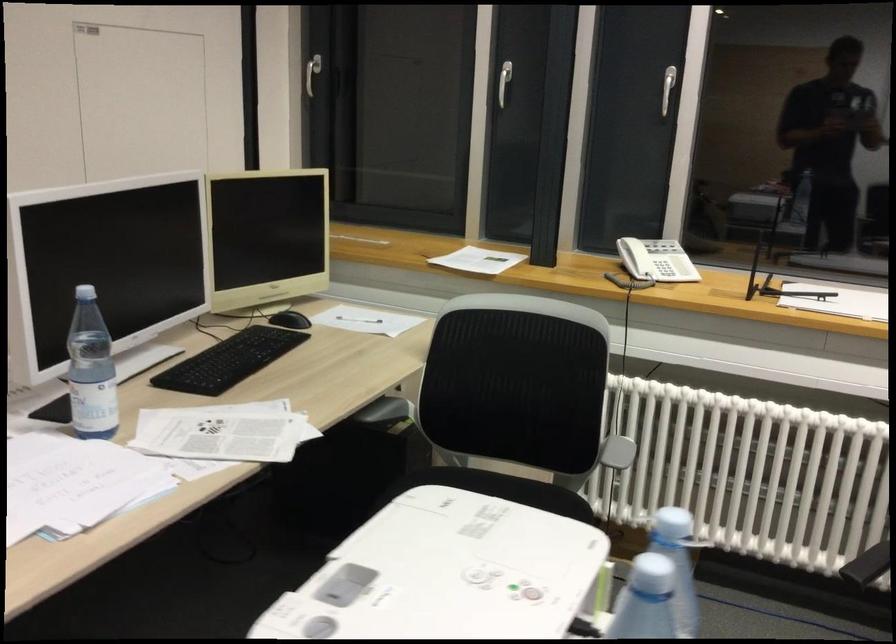
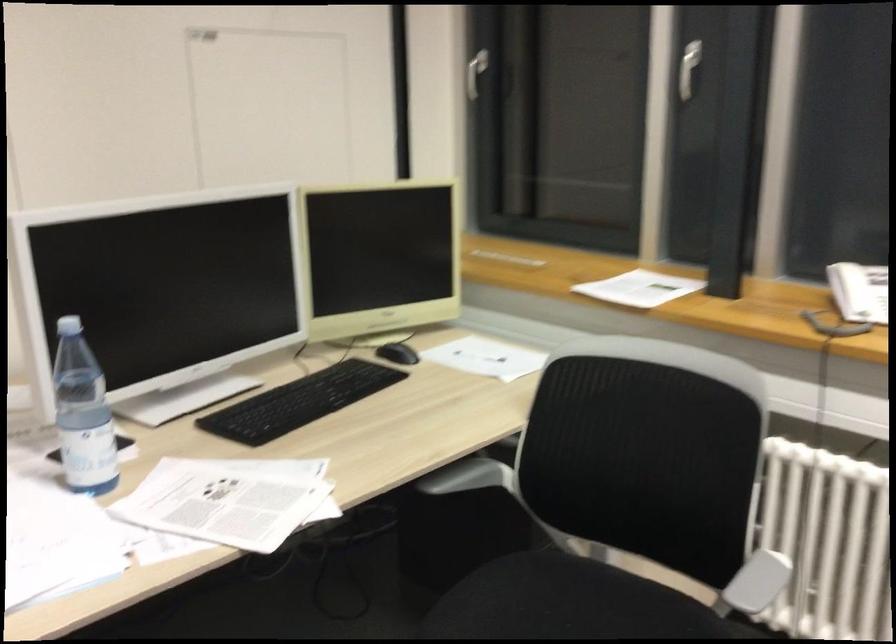
Question: How did the camera likely rotate?

Choices:
 (A) Left
 (B) Right
 (C) Up
 (D) Down

Answer: (A)